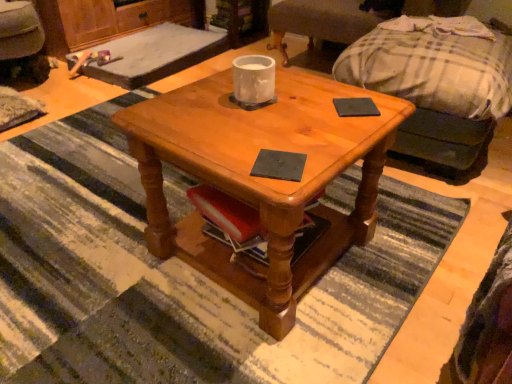
The image size is (512, 384). I want to click on vacant space to the right of black matte coaster at center, positioned as the second pad in back-to-front order, so click(x=335, y=151).